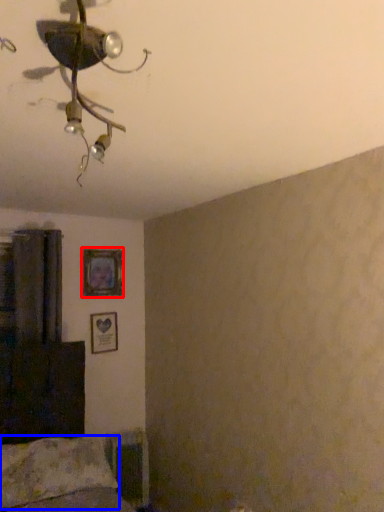
Question: Which object is closer to the camera taking this photo, picture frame (highlighted by a red box) or pillow (highlighted by a blue box)?

Choices:
 (A) picture frame
 (B) pillow

Answer: (B)